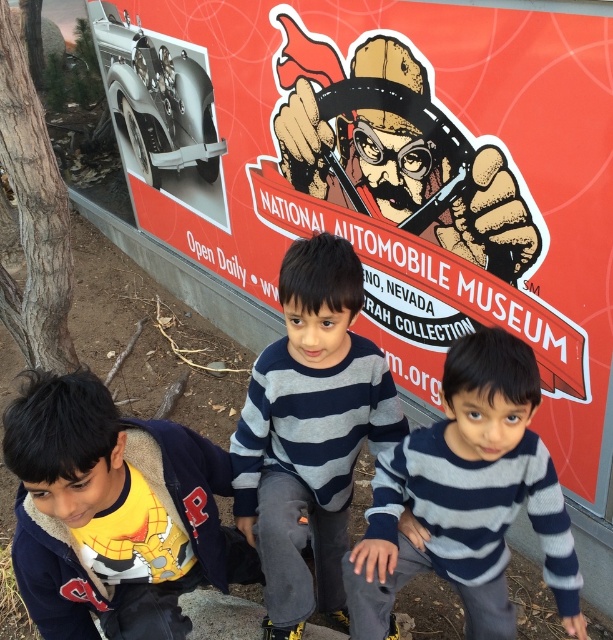
You are a photographer standing in front of the National Automobile Museum advertisement. You notice two boys wearing the yellow fleece jacket at lower left and the striped sweater at center. Which boy is positioned closer to the front of the group?

The yellow fleece jacket at lower left is closer to the viewer than the striped sweater at center, so the boy wearing the yellow fleece jacket at lower left is positioned closer to the front of the group.

You are a tour guide at the National Automobile Museum. You need to point out the museum name on the red matte sign at center to a visitor. However, you notice a black ink pen at upper center nearby. Which object should you point to, and why?

You should point to the red matte sign at center because it is larger in size than the black ink pen at upper center and contains the museum name.

You are a photographer standing 1.5 meters away from the camera. You want to take a photo of the yellow fleece jacket at lower left. Is the jacket within your camera range?

The yellow fleece jacket at lower left is 1.24 meters from the camera. Since you are standing 1.5 meters away from the camera, the jacket is within your camera range as it is closer than your position.